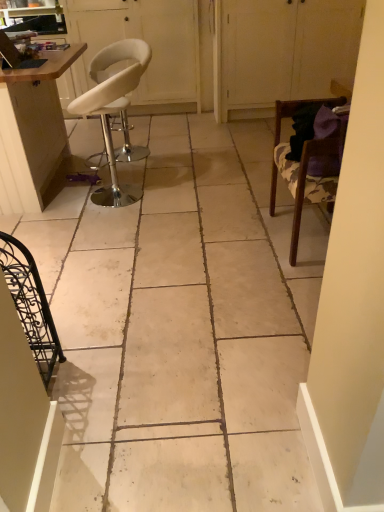
Question: Is wooden table at left turned away from white leather stool at upper left, the second screen door viewed from the right?

Choices:
 (A) yes
 (B) no

Answer: (B)

Question: Does wooden table at left have a lesser width compared to white leather stool at upper left, which ranks as the first screen door in left-to-right order?

Choices:
 (A) no
 (B) yes

Answer: (A)

Question: Considering the relative sizes of wooden table at left and white leather stool at upper left, the second screen door viewed from the right, in the image provided, is wooden table at left shorter than white leather stool at upper left, the second screen door viewed from the right,?

Choices:
 (A) yes
 (B) no

Answer: (A)

Question: Can you confirm if wooden table at left is positioned to the right of white leather stool at upper left, which ranks as the first screen door in left-to-right order?

Choices:
 (A) no
 (B) yes

Answer: (A)

Question: Is the position of wooden table at left less distant than that of white leather stool at upper left, which ranks as the first screen door in left-to-right order?

Choices:
 (A) no
 (B) yes

Answer: (B)

Question: Does wooden table at left have a greater width compared to white leather stool at upper left, which ranks as the first screen door in left-to-right order?

Choices:
 (A) no
 (B) yes

Answer: (B)

Question: Does white leather stool at left, the 1th chair in the back-to-front sequence, lie in front of white leather stool at upper left, the second screen door viewed from the right?

Choices:
 (A) no
 (B) yes

Answer: (B)

Question: From the image's perspective, does white leather stool at left, which ranks as the third chair in front-to-back order, appear higher than white leather stool at upper left, the second screen door viewed from the right?

Choices:
 (A) no
 (B) yes

Answer: (A)

Question: Considering the relative positions of white leather stool at left, which appears as the 2th chair when viewed from the left, and white leather stool at upper left, the second screen door viewed from the right, in the image provided, is white leather stool at left, which appears as the 2th chair when viewed from the left, to the left of white leather stool at upper left, the second screen door viewed from the right, from the viewer's perspective?

Choices:
 (A) yes
 (B) no

Answer: (B)

Question: Considering the relative positions of white leather stool at left, which appears as the 2th chair when viewed from the left, and white leather stool at upper left, which ranks as the first screen door in left-to-right order, in the image provided, is white leather stool at left, which appears as the 2th chair when viewed from the left, to the right of white leather stool at upper left, which ranks as the first screen door in left-to-right order, from the viewer's perspective?

Choices:
 (A) yes
 (B) no

Answer: (A)

Question: From a real-world perspective, is white leather stool at left, the 2th chair from the right, under white leather stool at upper left, which ranks as the first screen door in left-to-right order?

Choices:
 (A) no
 (B) yes

Answer: (B)

Question: Considering the relative sizes of white leather stool at left, the 2th chair from the right, and white leather stool at upper left, the second screen door viewed from the right, in the image provided, is white leather stool at left, the 2th chair from the right, smaller than white leather stool at upper left, the second screen door viewed from the right,?

Choices:
 (A) yes
 (B) no

Answer: (A)

Question: From a real-world perspective, is wooden chair at right, the first chair positioned from the right, physically below white matte cabinet at upper right, arranged as the 1th screen door when viewed from the right?

Choices:
 (A) no
 (B) yes

Answer: (B)